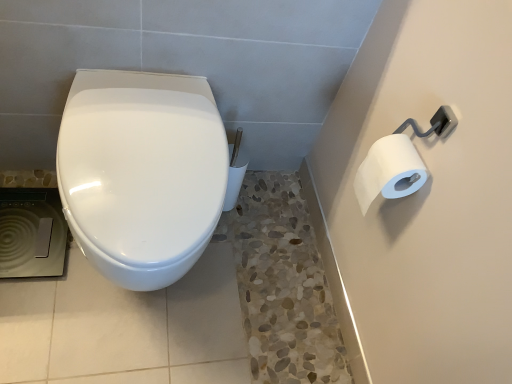
Question: Is white matte toilet paper at upper right surrounded by glossy ceramic toilet at center?

Choices:
 (A) no
 (B) yes

Answer: (A)

Question: Is glossy ceramic toilet at center aimed at white matte toilet paper at upper right?

Choices:
 (A) no
 (B) yes

Answer: (A)

Question: From the image's perspective, is glossy ceramic toilet at center below white matte toilet paper at upper right?

Choices:
 (A) yes
 (B) no

Answer: (A)

Question: Considering the relative sizes of glossy ceramic toilet at center and white matte toilet paper at upper right in the image provided, is glossy ceramic toilet at center smaller than white matte toilet paper at upper right?

Choices:
 (A) yes
 (B) no

Answer: (B)

Question: Are glossy ceramic toilet at center and white matte toilet paper at upper right making contact?

Choices:
 (A) no
 (B) yes

Answer: (A)

Question: Does glossy ceramic toilet at center have a larger size compared to white matte toilet paper at upper right?

Choices:
 (A) no
 (B) yes

Answer: (B)

Question: Does white matte toilet paper at upper right turn towards glossy ceramic toilet at center?

Choices:
 (A) yes
 (B) no

Answer: (A)

Question: Is white matte toilet paper at upper right positioned in front of glossy ceramic toilet at center?

Choices:
 (A) no
 (B) yes

Answer: (A)

Question: Does white matte toilet paper at upper right have a greater width compared to glossy ceramic toilet at center?

Choices:
 (A) yes
 (B) no

Answer: (B)

Question: From the image's perspective, does white matte toilet paper at upper right appear lower than glossy ceramic toilet at center?

Choices:
 (A) no
 (B) yes

Answer: (A)

Question: Is white matte toilet paper at upper right to the right of glossy ceramic toilet at center from the viewer's perspective?

Choices:
 (A) yes
 (B) no

Answer: (A)

Question: Considering the relative sizes of white matte toilet paper at upper right and glossy ceramic toilet at center in the image provided, is white matte toilet paper at upper right shorter than glossy ceramic toilet at center?

Choices:
 (A) no
 (B) yes

Answer: (B)

Question: From a real-world perspective, is white matte toilet paper at upper right above or below glossy ceramic toilet at center?

Choices:
 (A) above
 (B) below

Answer: (A)